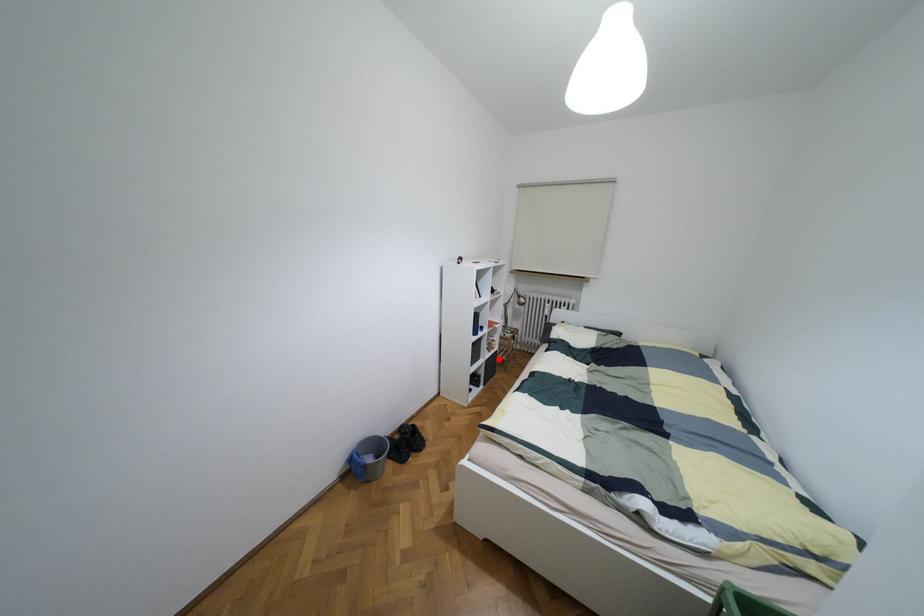
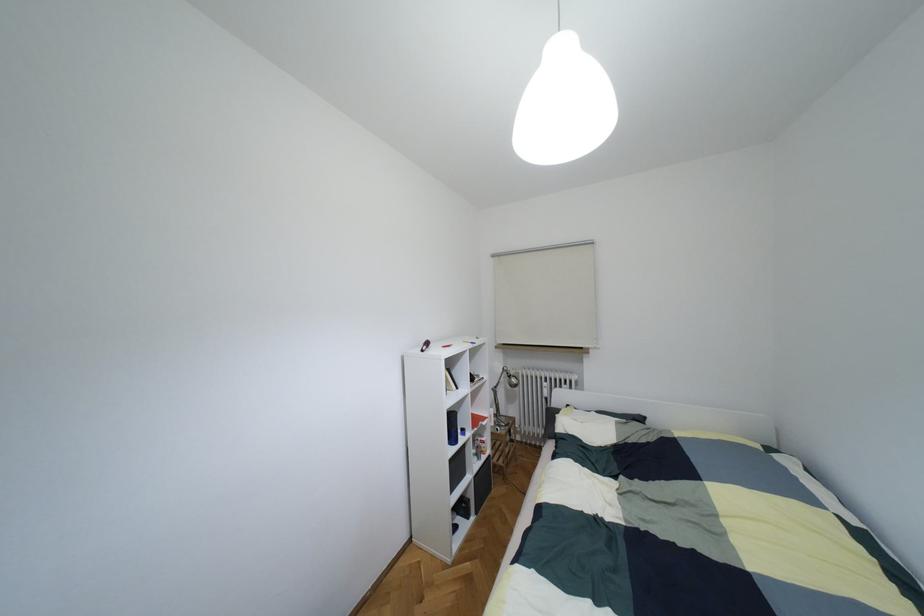
Question: I am providing you with two images of the same scene from different viewpoints. In image1, a red point is highlighted. Considering the same 3D point in image2, which of the following is correct?

Choices:
 (A) It is closer
 (B) It is farther

Answer: (B)